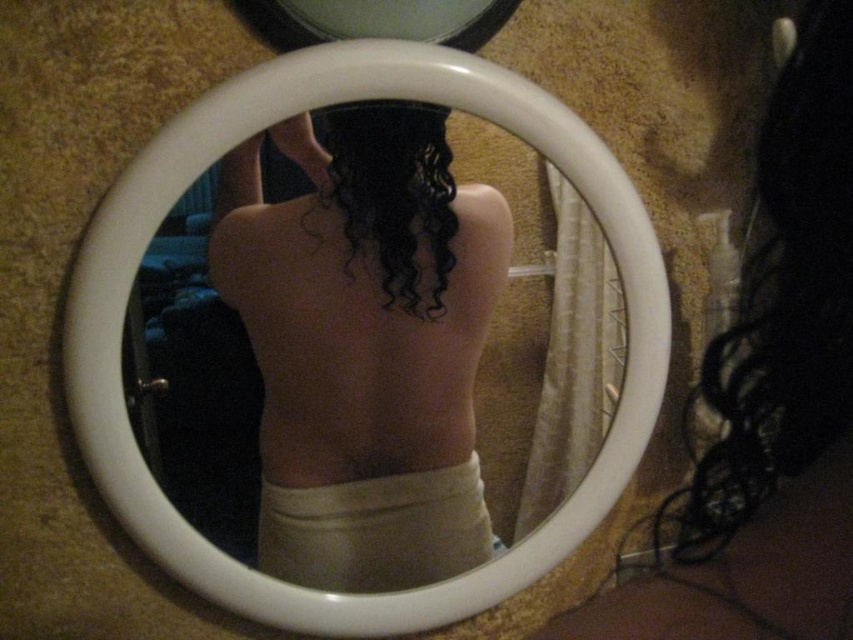
Is point (471, 113) behind point (396, 588)?

No.

Which of these two, white plastic mirror at center or white matte dress at lower center, stands shorter?

With less height is white matte dress at lower center.

Where is `white plastic mirror at center`? white plastic mirror at center is located at coordinates (218, 157).

Which is more to the left, white plastic mirror at center or black curly hair at upper right?

From the viewer's perspective, white plastic mirror at center appears more on the left side.

Does white plastic mirror at center have a larger size compared to black curly hair at upper right?

Correct, white plastic mirror at center is larger in size than black curly hair at upper right.

The image size is (853, 640). What do you see at coordinates (218, 157) in the screenshot?
I see `white plastic mirror at center` at bounding box center [218, 157].

The width and height of the screenshot is (853, 640). Identify the location of white plastic mirror at center. (218, 157).

Who is positioned more to the left, black curly hair at upper right or white matte dress at lower center?

white matte dress at lower center is more to the left.

Is black curly hair at upper right shorter than white matte dress at lower center?

Incorrect, black curly hair at upper right's height does not fall short of white matte dress at lower center's.

Is point (851, 42) positioned behind point (265, 536)?

No, it is in front of (265, 536).

In order to click on black curly hair at upper right in this screenshot , I will do `click(782, 300)`.